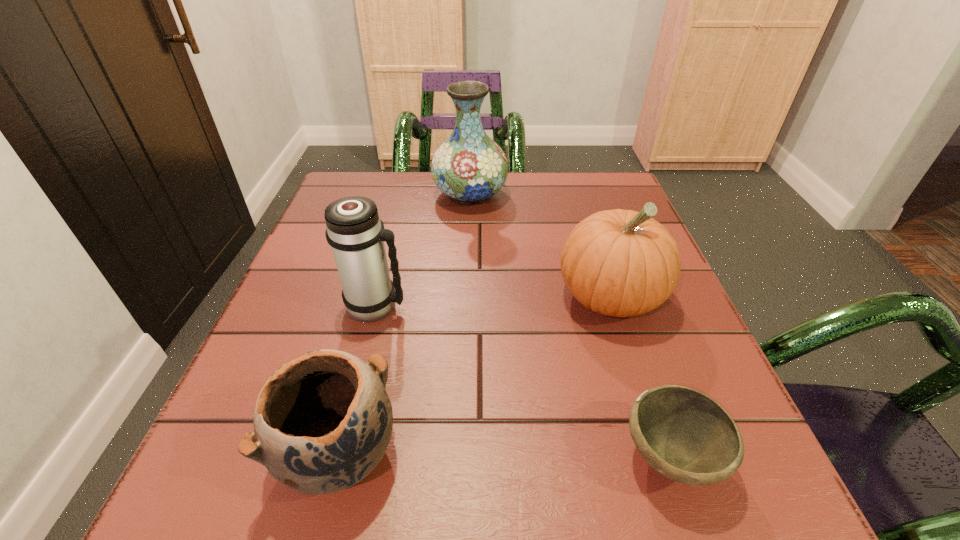
In the image, there is a desktop. At what (x,y) coordinates should I click in order to perform the action: click on vacant space at the far edge. Please return your answer as a coordinate pair (x, y). This screenshot has height=540, width=960. Looking at the image, I should click on (406, 179).

The height and width of the screenshot is (540, 960). In order to click on free location at the near edge in this screenshot , I will do `click(553, 492)`.

You are a GUI agent. You are given a task and a screenshot of the screen. Output one action in this format:
    pyautogui.click(x=<x>, y=<y>)
    Task: Click on the free space at the left edge of the desktop
    The height and width of the screenshot is (540, 960).
    Given the screenshot: What is the action you would take?
    pyautogui.click(x=231, y=411)

At what (x,y) coordinates should I click in order to perform the action: click on free space at the right edge. Please return your answer as a coordinate pair (x, y). Looking at the image, I should click on (608, 332).

Locate an element on the screen. The height and width of the screenshot is (540, 960). free spot at the far left corner of the desktop is located at coordinates (398, 174).

In the image, there is a desktop. Identify the location of vacant space at the far right corner. tap(575, 207).

Locate an element on the screen. blank region between the fourth tallest object and the bowl is located at coordinates (504, 455).

The image size is (960, 540). Find the location of `free space between the pumpkin and the shortest object`. free space between the pumpkin and the shortest object is located at coordinates (639, 377).

In order to click on vacant space in between the tallest object and the bowl in this screenshot , I will do `click(570, 326)`.

The width and height of the screenshot is (960, 540). Identify the location of empty space that is in between the fourth tallest object and the vase. (404, 323).